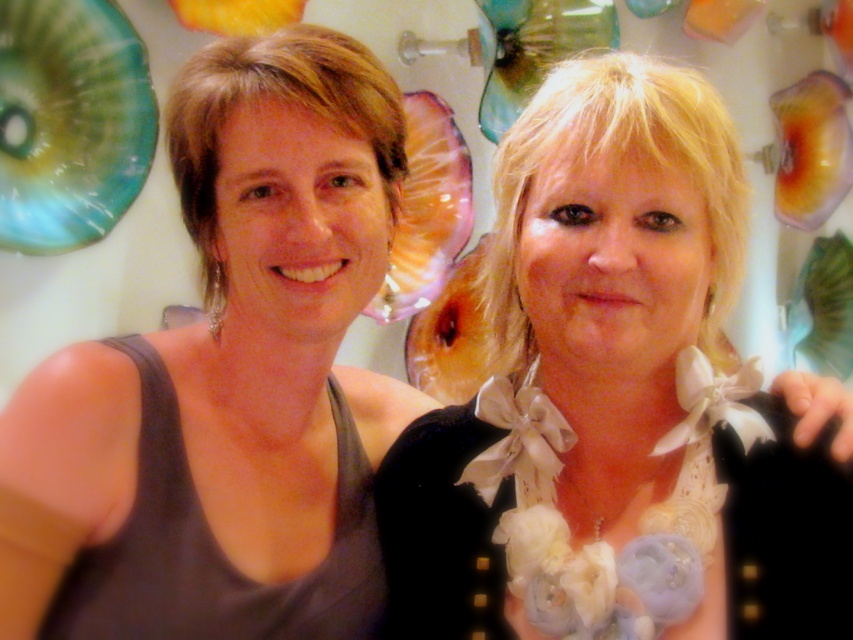
Question: Is white satin bow at right bigger than matte black tank top at left?

Choices:
 (A) yes
 (B) no

Answer: (A)

Question: Which point is closer to the camera taking this photo?

Choices:
 (A) (258, 465)
 (B) (537, 108)

Answer: (B)

Question: Which object appears closest to the camera in this image?

Choices:
 (A) matte black tank top at left
 (B) white satin bow at right

Answer: (B)

Question: Observing the image, what is the correct spatial positioning of white satin bow at right in reference to matte black tank top at left?

Choices:
 (A) above
 (B) below

Answer: (B)

Question: Can you confirm if white satin bow at right is thinner than matte black tank top at left?

Choices:
 (A) no
 (B) yes

Answer: (A)